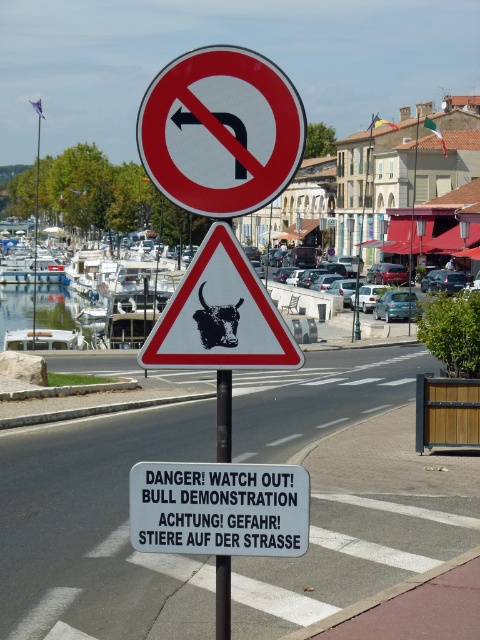
Question: Based on their relative distances, which object is nearer to the white triangular warning sign with black bull at center at upper center?

Choices:
 (A) red plastic sign at upper center
 (B) brushed metal pole at center

Answer: (B)

Question: Is red plastic sign at upper center positioned behind white triangular warning sign with black bull at center at upper center?

Choices:
 (A) no
 (B) yes

Answer: (B)

Question: Is red plastic sign at upper center smaller than white plastic sign at center?

Choices:
 (A) yes
 (B) no

Answer: (B)

Question: Which object is farther from the camera taking this photo?

Choices:
 (A) white plastic sign at center
 (B) red plastic sign at upper center
 (C) white triangular warning sign with black bull at center at upper center
 (D) brushed metal pole at center

Answer: (D)

Question: Observing the image, what is the correct spatial positioning of red plastic sign at upper center in reference to white triangular warning sign with black bull at center at upper center?

Choices:
 (A) left
 (B) right

Answer: (A)

Question: Which of the following is the closest to the observer?

Choices:
 (A) white triangular warning sign with black bull at center at upper center
 (B) brushed metal pole at center
 (C) red plastic sign at upper center
 (D) white plastic sign at center

Answer: (A)